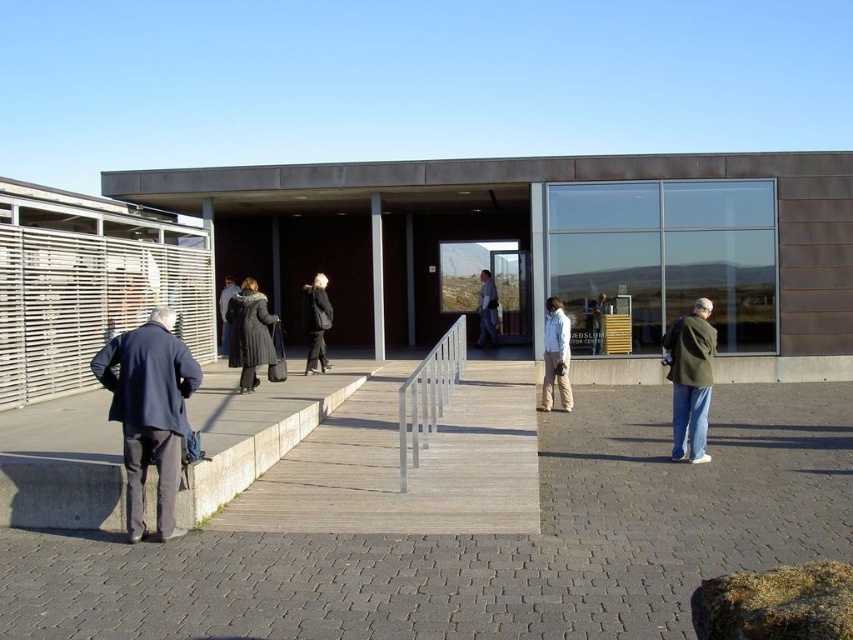
Question: Which point is closer to the camera?

Choices:
 (A) (228, 278)
 (B) (682, 422)
 (C) (314, 353)
 (D) (135, 378)

Answer: (D)

Question: Is dark gray coat at center above dark blue coat at center?

Choices:
 (A) yes
 (B) no

Answer: (B)

Question: Is silver metallic rail at center thinner than dark blue coat at center?

Choices:
 (A) yes
 (B) no

Answer: (B)

Question: Which object appears farthest from the camera in this image?

Choices:
 (A) dark blue coat at center
 (B) silver metallic rail at center

Answer: (A)

Question: Where is dark blue coat at left located in relation to dark gray coat at center in the image?

Choices:
 (A) left
 (B) right

Answer: (A)

Question: Which point is farther from the camera taking this photo?

Choices:
 (A) 230,284
 (B) 706,381

Answer: (A)